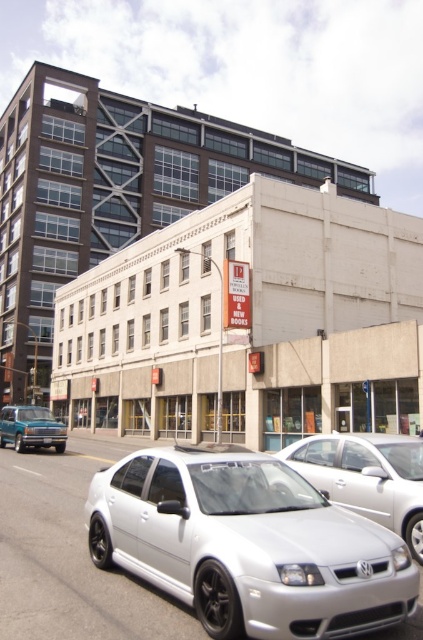
Question: Which object appears closest to the camera in this image?

Choices:
 (A) black plastic license plate at center
 (B) teal metallic truck at lower left
 (C) silver metallic car at center

Answer: (C)

Question: Does silver metallic car at center have a greater width compared to silver metallic sedan at center?

Choices:
 (A) yes
 (B) no

Answer: (A)

Question: Estimate the real-world distances between objects in this image. Which object is closer to the silver metallic car at center?

Choices:
 (A) silver metallic sedan at center
 (B) black plastic license plate at center
 (C) teal metallic truck at lower left

Answer: (A)

Question: Can you confirm if silver metallic car at center is positioned to the left of teal metallic truck at lower left?

Choices:
 (A) no
 (B) yes

Answer: (A)

Question: Which point appears farthest from the camera in this image?

Choices:
 (A) (211, 502)
 (B) (52, 433)

Answer: (B)

Question: Does silver metallic car at center lie behind black plastic license plate at center?

Choices:
 (A) no
 (B) yes

Answer: (A)